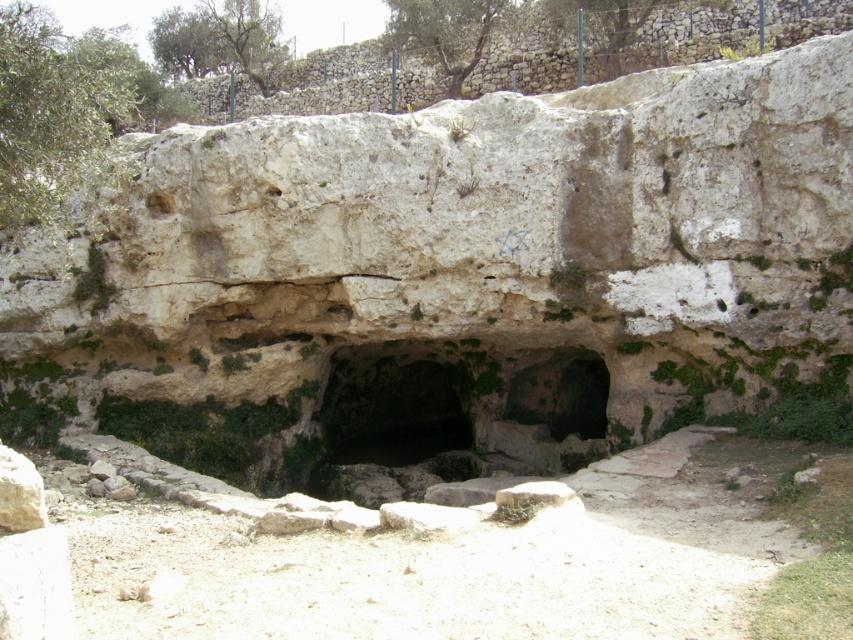
You are an explorer trying to reach the cave entrance. You see the green mossy rock at center and the smooth stone hole at upper left. Which object is closer to the cave entrance?

The green mossy rock at center is closer to the cave entrance because it is shorter than the smooth stone hole at upper left, meaning it is positioned lower and nearer to the base where the cave entrance is located.

You are a hiker with a 5 meter long rope. You need to cross a gap between the green mossy rock at center and the smooth stone hole at upper left. Can your rope reach across the gap?

The distance between the green mossy rock at center and the smooth stone hole at upper left is 6.26 meters. Since your rope is only 5 meters long, it cannot span the gap. You will need a longer rope or an alternative method to cross.

You are an explorer standing at the cave entrance and want to reach the smooth stone hole at upper left. Which direction should you look to find the green mossy rock at center?

The green mossy rock at center is located below the smooth stone hole at upper left, so you should look downward from the smooth stone hole at upper left to find it.